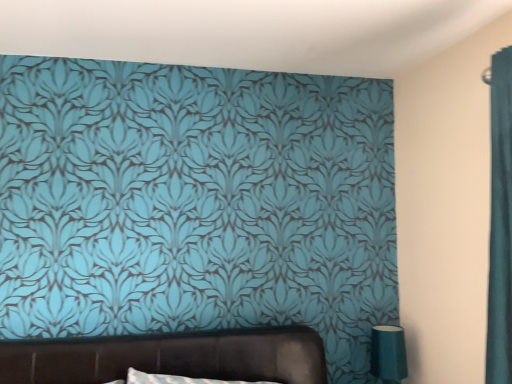
Question: From the image's perspective, is brown leather bed at center located beneath teal glossy table lamp at lower right?

Choices:
 (A) no
 (B) yes

Answer: (A)

Question: Is brown leather bed at center oriented away from teal glossy table lamp at lower right?

Choices:
 (A) no
 (B) yes

Answer: (A)

Question: Is brown leather bed at center located outside teal glossy table lamp at lower right?

Choices:
 (A) yes
 (B) no

Answer: (A)

Question: Does brown leather bed at center lie in front of teal glossy table lamp at lower right?

Choices:
 (A) no
 (B) yes

Answer: (B)

Question: Is brown leather bed at center at the right side of teal glossy table lamp at lower right?

Choices:
 (A) no
 (B) yes

Answer: (A)

Question: Is brown leather bed at center at the left side of teal glossy table lamp at lower right?

Choices:
 (A) yes
 (B) no

Answer: (A)

Question: Would you say teal glossy table lamp at lower right is outside brown leather bed at center?

Choices:
 (A) yes
 (B) no

Answer: (A)

Question: From the image's perspective, does teal glossy table lamp at lower right appear lower than brown leather bed at center?

Choices:
 (A) no
 (B) yes

Answer: (B)

Question: Does teal glossy table lamp at lower right lie in front of brown leather bed at center?

Choices:
 (A) no
 (B) yes

Answer: (A)

Question: From a real-world perspective, is teal glossy table lamp at lower right over brown leather bed at center?

Choices:
 (A) yes
 (B) no

Answer: (B)

Question: From the image's perspective, is teal glossy table lamp at lower right on brown leather bed at center?

Choices:
 (A) yes
 (B) no

Answer: (B)

Question: Is teal glossy table lamp at lower right aimed at brown leather bed at center?

Choices:
 (A) yes
 (B) no

Answer: (B)

Question: Considering the positions of teal glossy table lamp at lower right and brown leather bed at center in the image, is teal glossy table lamp at lower right bigger or smaller than brown leather bed at center?

Choices:
 (A) big
 (B) small

Answer: (B)